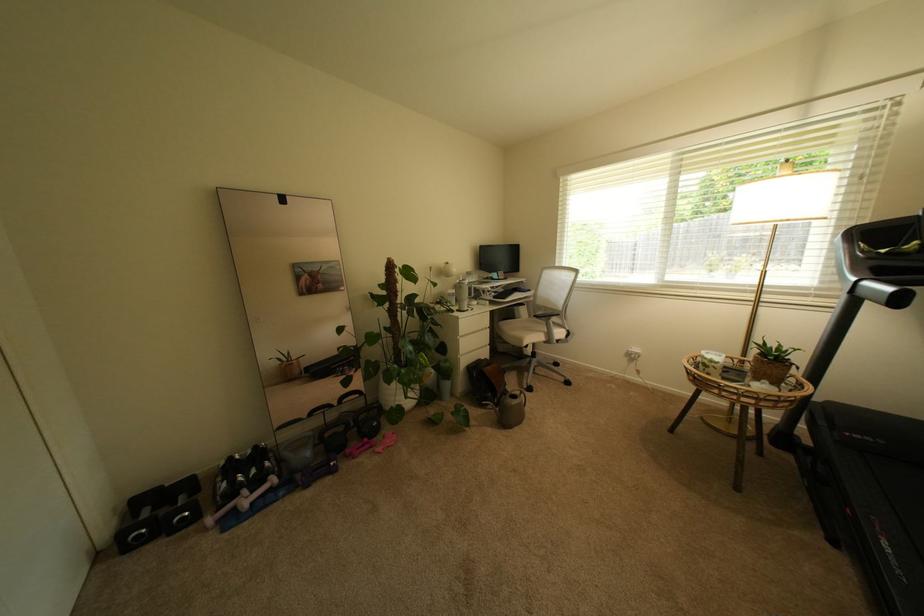
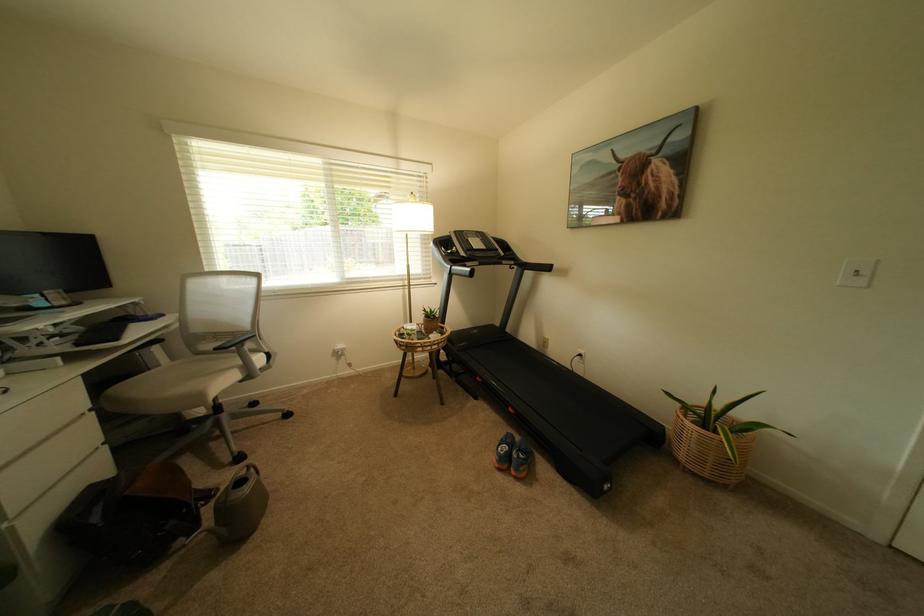
Question: The camera is either moving clockwise (left) or counter-clockwise (right) around the object. The first image is from the beginning of the video and the second image is from the end. Is the camera moving left or right when shooting the video?

Choices:
 (A) Left
 (B) Right

Answer: (A)